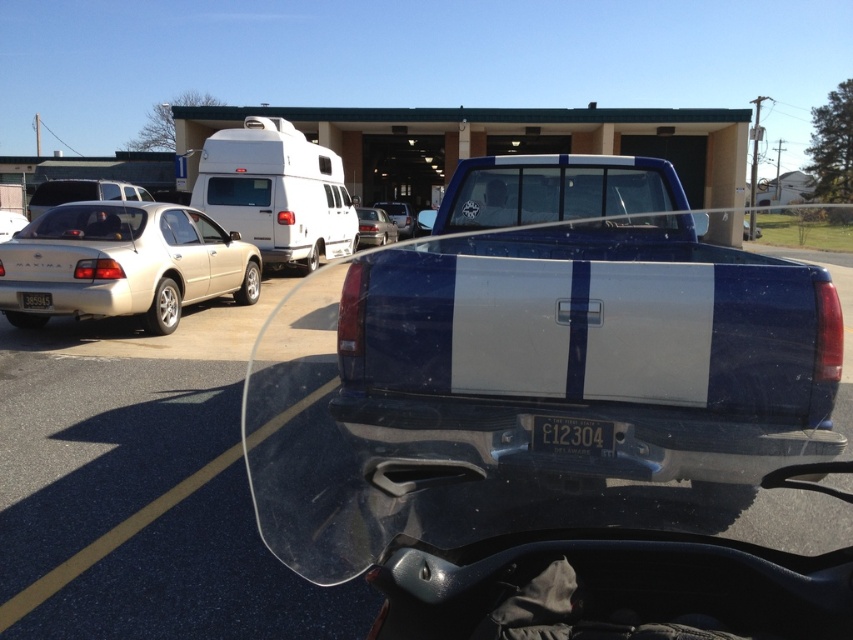
Based on the photo, you are a parking attendant who needs to fit a compact car into a parking spot. The gold metallic sedan at left and the yellow matte license plate at center are in your way. Which object should you move to allow more space for the compact car?

The gold metallic sedan at left is larger in size than the yellow matte license plate at center, so you should move the gold metallic sedan at left to create more space for the compact car.